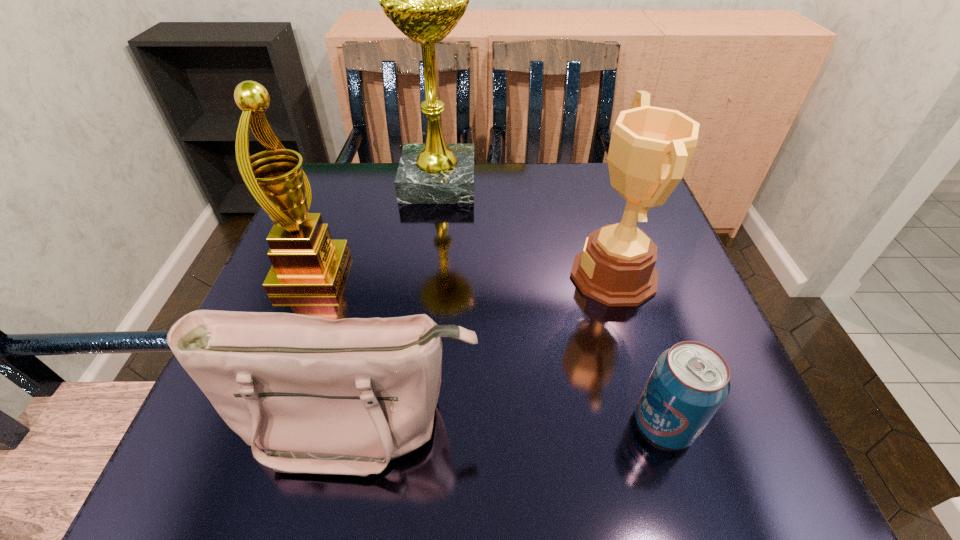
Find the location of a particular element. The width and height of the screenshot is (960, 540). object at the near right corner is located at coordinates (689, 382).

Locate an element on the screen. Image resolution: width=960 pixels, height=540 pixels. free space at the far edge of the desktop is located at coordinates (496, 213).

You are a GUI agent. You are given a task and a screenshot of the screen. Output one action in this format:
    pyautogui.click(x=<x>, y=<y>)
    Task: Click on the free region at the near edge of the desktop
    
    Given the screenshot: What is the action you would take?
    pyautogui.click(x=552, y=476)

Locate an element on the screen. The width and height of the screenshot is (960, 540). vacant space at the right edge of the desktop is located at coordinates (640, 362).

In order to click on vacant position at the far left corner of the desktop in this screenshot , I will do `click(377, 198)`.

Identify the location of vacant space in between the leftmost award and the shortest object. (488, 348).

The image size is (960, 540). Find the location of `blank region between the farthest award and the shortest object`. blank region between the farthest award and the shortest object is located at coordinates (551, 303).

Identify the location of vacant area between the shortest object and the leftmost award. (488, 348).

Find the location of a particular element. This screenshot has height=540, width=960. vacant space that's between the shortest object and the shoulder bag is located at coordinates (511, 423).

Identify the location of free spot between the pop soda and the second shortest object. The image size is (960, 540). (511, 423).